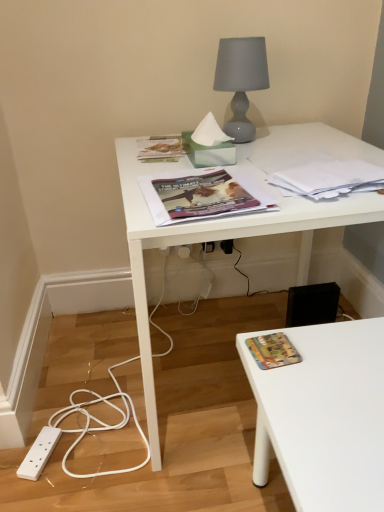
Locate an element on the screen. The width and height of the screenshot is (384, 512). free space behind matte magazine at center, the 2th book cover ordered from the bottom is located at coordinates (187, 158).